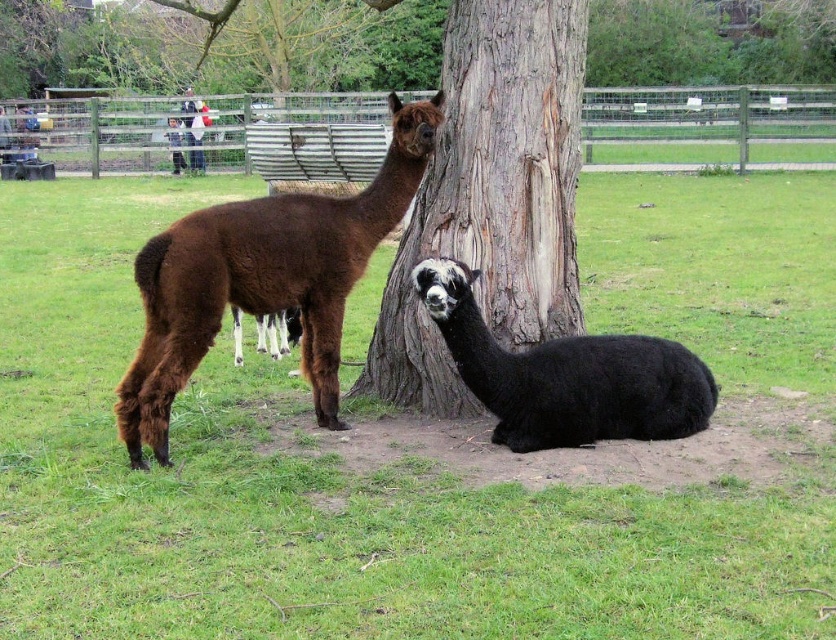
Question: Is brown woolly alpaca at left bigger than white paper bag at upper center?

Choices:
 (A) no
 (B) yes

Answer: (A)

Question: Considering the real-world distances, which object is farthest from the black woolly alpaca at lower center?

Choices:
 (A) white paper bag at upper center
 (B) brown woolly alpaca at left

Answer: (A)

Question: Is brown rough bark at center bigger than brown woolly alpaca at left?

Choices:
 (A) yes
 (B) no

Answer: (B)

Question: Observing the image, what is the correct spatial positioning of brown woolly alpaca at left in reference to white paper bag at upper center?

Choices:
 (A) left
 (B) right

Answer: (B)

Question: Which object appears farthest from the camera in this image?

Choices:
 (A) brown woolly alpaca at left
 (B) white paper bag at upper center
 (C) black woolly alpaca at lower center
 (D) brown rough bark at center

Answer: (B)

Question: Which point is farther to the camera?

Choices:
 (A) click(411, 166)
 (B) click(202, 157)

Answer: (B)